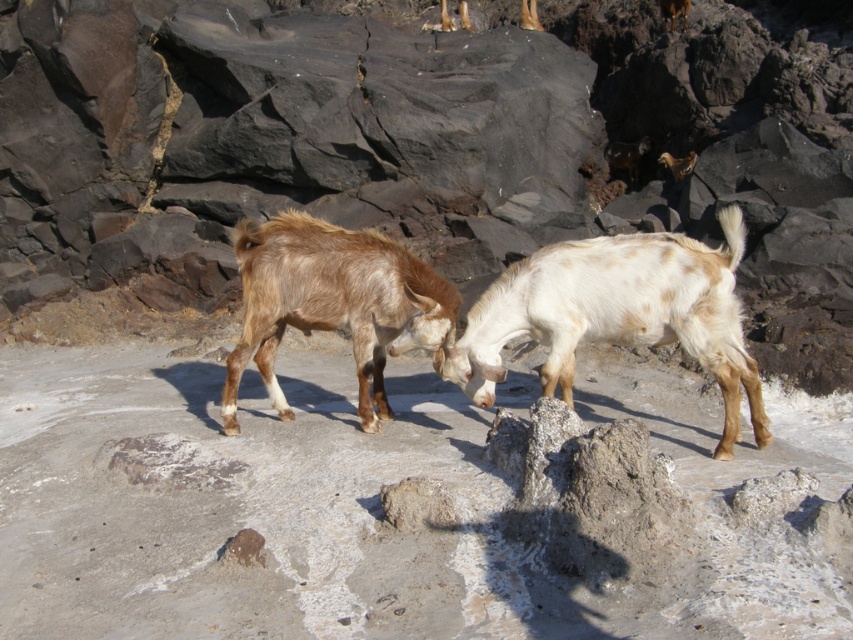
Question: From the image, what is the correct spatial relationship of white speckled fur at center in relation to brown fuzzy goat at center?

Choices:
 (A) below
 (B) above

Answer: (A)

Question: Does white speckled fur at center have a smaller size compared to brown fuzzy goat at center?

Choices:
 (A) no
 (B) yes

Answer: (A)

Question: Observing the image, what is the correct spatial positioning of white speckled fur at center in reference to brown fuzzy goat at center?

Choices:
 (A) right
 (B) left

Answer: (A)